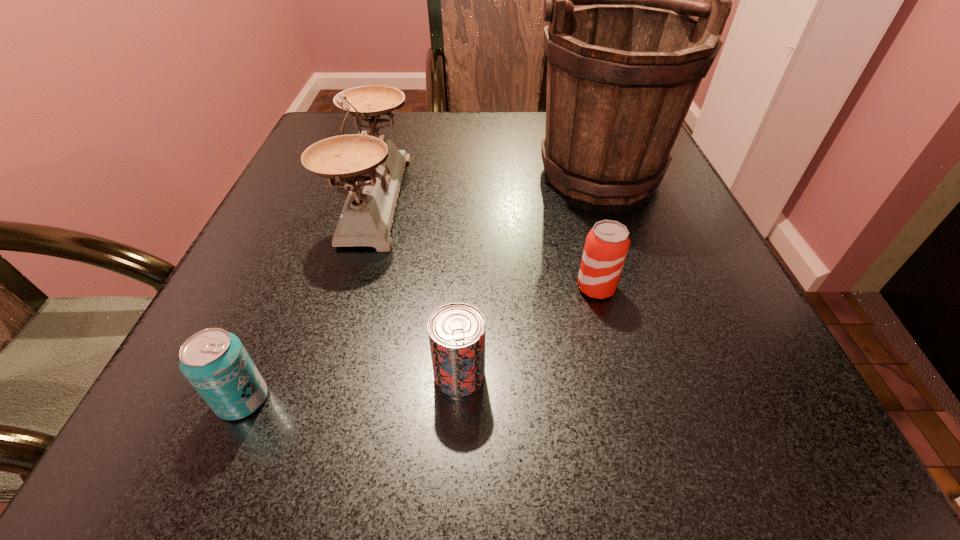
The width and height of the screenshot is (960, 540). Identify the location of free space between the leftmost beer can and the third object from left to right. (350, 387).

Locate an element on the screen. The height and width of the screenshot is (540, 960). free spot between the leftmost beer can and the scale is located at coordinates (308, 299).

Find the location of a particular element. The image size is (960, 540). vacant space that's between the scale and the tallest object is located at coordinates (484, 177).

Image resolution: width=960 pixels, height=540 pixels. What are the coordinates of `free space between the fourth shortest object and the third farthest object` in the screenshot? It's located at (485, 242).

Where is `vacant region between the leftmost beer can and the second beer can from right to left`? The image size is (960, 540). vacant region between the leftmost beer can and the second beer can from right to left is located at coordinates (350, 387).

Locate an element on the screen. This screenshot has height=540, width=960. free point between the rightmost beer can and the scale is located at coordinates (485, 242).

Find the location of a particular element. blank region between the scale and the leftmost beer can is located at coordinates (308, 299).

Identify which object is the third closest to the fourth shortest object. Please provide its 2D coordinates. Your answer should be formatted as a tuple, i.e. [(x, y)], where the tuple contains the x and y coordinates of a point satisfying the conditions above.

[(622, 73)]

I want to click on object that is the second closest to the bucket, so click(372, 168).

At what (x,y) coordinates should I click in order to perform the action: click on the second closest beer can relative to the fourth shortest object. Please return your answer as a coordinate pair (x, y). Looking at the image, I should click on (214, 361).